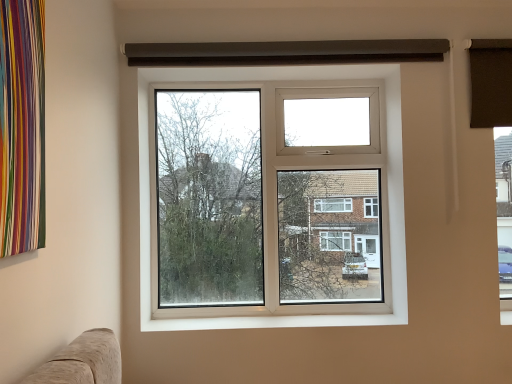
Locate an element on the screen. Image resolution: width=512 pixels, height=384 pixels. white smooth window sill at lower center is located at coordinates (271, 320).

The width and height of the screenshot is (512, 384). What do you see at coordinates (271, 320) in the screenshot?
I see `white smooth window sill at lower center` at bounding box center [271, 320].

In the scene shown: In order to face white plastic window at center, should I rotate leftwards or rightwards?

Turn right by 2.201 degrees to look at white plastic window at center.

This screenshot has width=512, height=384. Describe the element at coordinates (261, 84) in the screenshot. I see `white plastic window at center` at that location.

Identify the location of white plastic window at center. (261, 84).

At what (x,y) coordinates should I click in order to perform the action: click on white smooth window sill at lower center. Please return your answer as a coordinate pair (x, y). This screenshot has width=512, height=384. Looking at the image, I should click on (271, 320).

Considering the relative positions of white plastic window at center and white smooth window sill at lower center in the image provided, is white plastic window at center to the left or to the right of white smooth window sill at lower center?

From the image, it's evident that white plastic window at center is to the left of white smooth window sill at lower center.

Which object is closer to the camera, white plastic window at center or white smooth window sill at lower center?

white smooth window sill at lower center is closer to the camera.

Does point (403, 271) lie behind point (146, 314)?

No, (403, 271) is closer to viewer.

From the image's perspective, is white plastic window at center located beneath white smooth window sill at lower center?

No, from the image's perspective, white plastic window at center is not beneath white smooth window sill at lower center.

From a real-world perspective, which is physically below, white plastic window at center or white smooth window sill at lower center?

In real-world perspective, white smooth window sill at lower center is lower.

Between white plastic window at center and white smooth window sill at lower center, which one has larger width?

white smooth window sill at lower center.

Between white plastic window at center and white smooth window sill at lower center, which one has more height?

Standing taller between the two is white plastic window at center.

Between white plastic window at center and white smooth window sill at lower center, which one has smaller size?

Smaller between the two is white smooth window sill at lower center.

Is white smooth window sill at lower center located within white plastic window at center?

No.

Are white plastic window at center and white smooth window sill at lower center making contact?

No, white plastic window at center is not beside white smooth window sill at lower center.

Is white smooth window sill at lower center at the back of white plastic window at center?

white plastic window at center does not have its back to white smooth window sill at lower center.

Identify the location of window behind the white smooth window sill at lower center. (261, 84).

Can you confirm if white smooth window sill at lower center is positioned to the right of white plastic window at center?

Correct, you'll find white smooth window sill at lower center to the right of white plastic window at center.

Considering the positions of objects white smooth window sill at lower center and white plastic window at center in the image provided, who is behind, white smooth window sill at lower center or white plastic window at center?

Positioned behind is white plastic window at center.

Is point (341, 313) farther from camera compared to point (283, 66)?

Yes.

From the image's perspective, is white smooth window sill at lower center below white plastic window at center?

Yes, from the image's perspective, white smooth window sill at lower center is below white plastic window at center.

From a real-world perspective, between white smooth window sill at lower center and white plastic window at center, who is vertically higher?

In real-world perspective, white plastic window at center is above.

Can you confirm if white smooth window sill at lower center is thinner than white plastic window at center?

Incorrect, the width of white smooth window sill at lower center is not less than that of white plastic window at center.

Is white smooth window sill at lower center shorter than white plastic window at center?

Indeed, white smooth window sill at lower center has a lesser height compared to white plastic window at center.

Considering the relative sizes of white smooth window sill at lower center and white plastic window at center in the image provided, is white smooth window sill at lower center bigger than white plastic window at center?

Incorrect, white smooth window sill at lower center is not larger than white plastic window at center.

Is white plastic window at center a part of white smooth window sill at lower center?

Definitely not — white plastic window at center is not inside white smooth window sill at lower center.

Does white smooth window sill at lower center touch white plastic window at center?

white smooth window sill at lower center and white plastic window at center are clearly separated.

Is white smooth window sill at lower center turned away from white plastic window at center?

Correct, white smooth window sill at lower center is looking away from white plastic window at center.

The width and height of the screenshot is (512, 384). What are the coordinates of `window located above the white smooth window sill at lower center (from the image's perspective)` in the screenshot? It's located at (261, 84).

In order to click on window above the white smooth window sill at lower center (from a real-world perspective) in this screenshot , I will do `click(261, 84)`.

At what (x,y) coordinates should I click in order to perform the action: click on window behind the white smooth window sill at lower center. Please return your answer as a coordinate pair (x, y). The width and height of the screenshot is (512, 384). Looking at the image, I should click on (261, 84).